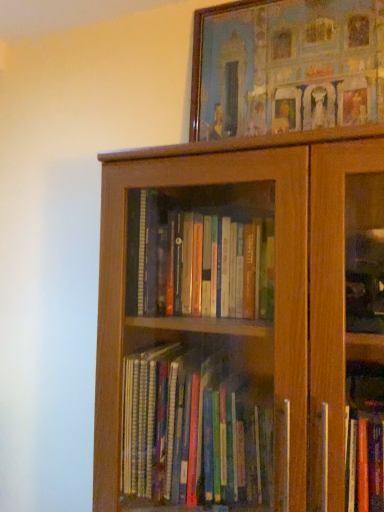
The width and height of the screenshot is (384, 512). Find the location of `wooden picture frame at upper center`. wooden picture frame at upper center is located at coordinates (286, 66).

Measure the distance between wooden picture frame at upper center and camera.

38.46 inches.

Describe the element at coordinates (286, 66) in the screenshot. This screenshot has height=512, width=384. I see `wooden picture frame at upper center` at that location.

In order to click on wooden picture frame at upper center in this screenshot , I will do `click(286, 66)`.